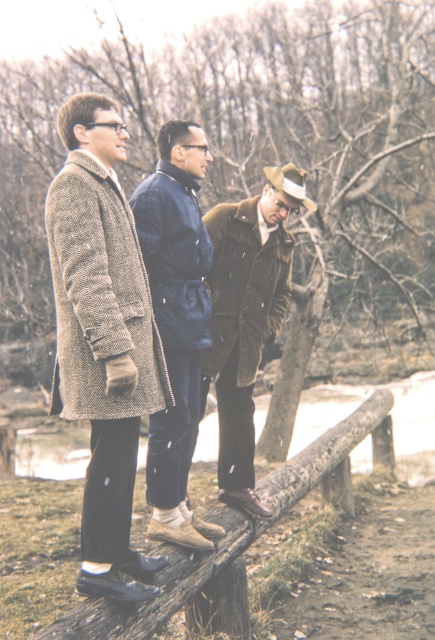
You are standing in the scene and want to hand a book to the person wearing the brown tweed coat at left. If you can reach up to 2 meters, can you reach them without moving closer?

The brown tweed coat at left and viewer are 3.14 meters apart from each other, so you cannot reach them as your maximum reach is 2 meters.

You are a photographer trying to capture a photo of the brown fuzzy coat at center and the brown wooden rail at center. Which object should you focus on if you want to ensure both are in the frame without moving the camera?

You should focus on the brown wooden rail at center because it is narrower than the brown fuzzy coat at center, so it will fit within the frame more easily.

You are standing on the wooden fence and want to hand a tool to the person wearing the brown fuzzy coat at center. Which direction should you move relative to the brown wooden rail at center to reach them?

The brown fuzzy coat at center is to the right of the brown wooden rail at center, so you should move to the right of the brown wooden rail at center to reach them.